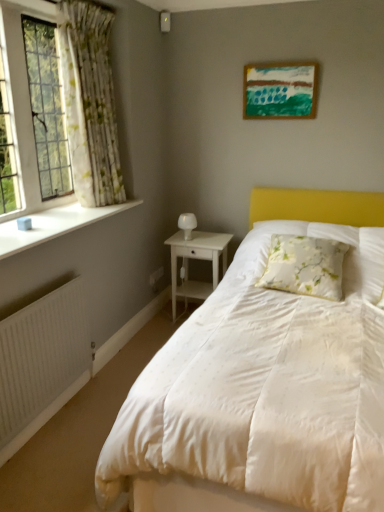
Question: Is white glossy table lamp at center thinner than floral fabric pillow at center?

Choices:
 (A) yes
 (B) no

Answer: (A)

Question: Does white glossy table lamp at center come behind floral fabric pillow at center?

Choices:
 (A) yes
 (B) no

Answer: (A)

Question: From the image's perspective, does white glossy table lamp at center appear lower than floral fabric pillow at center?

Choices:
 (A) yes
 (B) no

Answer: (B)

Question: From a real-world perspective, is white glossy table lamp at center under floral fabric pillow at center?

Choices:
 (A) no
 (B) yes

Answer: (A)

Question: Can you confirm if white glossy table lamp at center is bigger than floral fabric pillow at center?

Choices:
 (A) yes
 (B) no

Answer: (B)

Question: From their relative heights in the image, would you say white ribbed radiator at lower left is taller or shorter than floral fabric pillow at center?

Choices:
 (A) short
 (B) tall

Answer: (B)

Question: Considering the relative positions of white ribbed radiator at lower left and floral fabric pillow at center in the image provided, is white ribbed radiator at lower left to the left or to the right of floral fabric pillow at center?

Choices:
 (A) right
 (B) left

Answer: (B)

Question: Is white ribbed radiator at lower left bigger or smaller than floral fabric pillow at center?

Choices:
 (A) big
 (B) small

Answer: (B)

Question: Is point (62, 343) positioned closer to the camera than point (286, 261)?

Choices:
 (A) farther
 (B) closer

Answer: (B)

Question: Choose the correct answer: Is white wood nightstand at center inside white smooth window sill at left or outside it?

Choices:
 (A) inside
 (B) outside

Answer: (B)

Question: From the image's perspective, is white wood nightstand at center above or below white smooth window sill at left?

Choices:
 (A) below
 (B) above

Answer: (A)

Question: From a real-world perspective, is white wood nightstand at center positioned above or below white smooth window sill at left?

Choices:
 (A) above
 (B) below

Answer: (B)

Question: Considering the positions of white wood nightstand at center and white smooth window sill at left in the image, is white wood nightstand at center wider or thinner than white smooth window sill at left?

Choices:
 (A) wide
 (B) thin

Answer: (A)

Question: Is wooden painted picture frame at upper center taller or shorter than white wood nightstand at center?

Choices:
 (A) short
 (B) tall

Answer: (A)

Question: Is wooden painted picture frame at upper center bigger or smaller than white wood nightstand at center?

Choices:
 (A) big
 (B) small

Answer: (B)